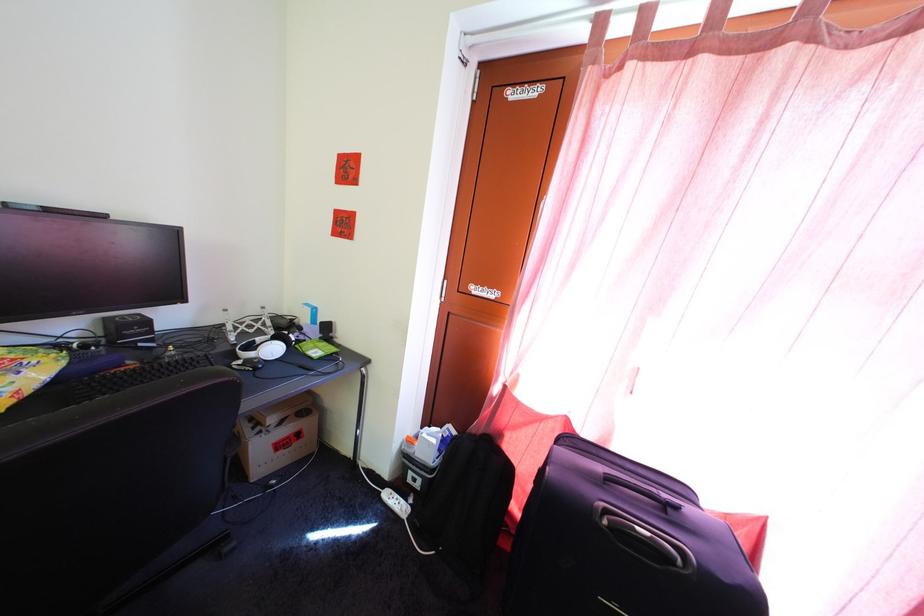
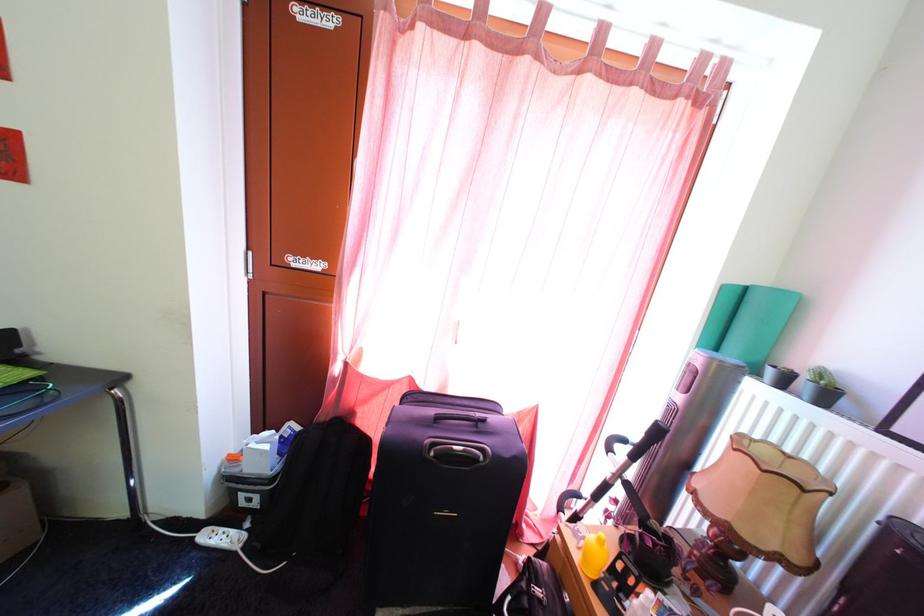
Find the pixel in the second image that matches pixel 427 493 in the first image.

(264, 512)